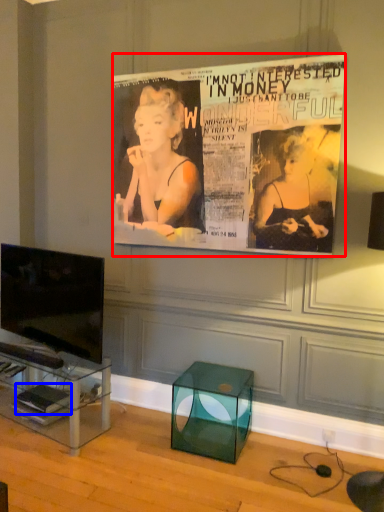
Question: Which point is closer to the camera, poster (highlighted by a red box) or magazine (highlighted by a blue box)?

Choices:
 (A) poster
 (B) magazine

Answer: (A)